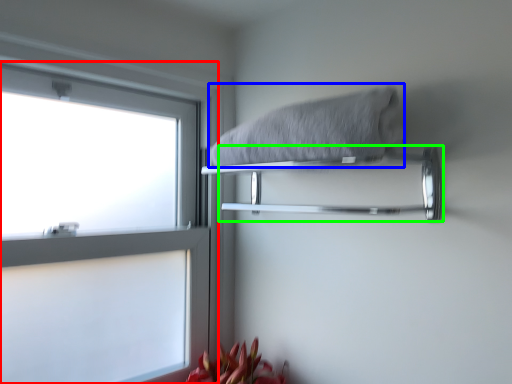
Question: Which object is positioned farthest from window (highlighted by a red box)? Select from bath towel (highlighted by a blue box) and towel bar (highlighted by a green box).

Choices:
 (A) bath towel
 (B) towel bar

Answer: (A)